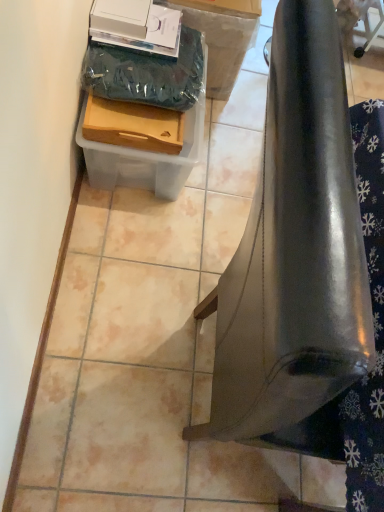
Locate an element on the screen. The height and width of the screenshot is (512, 384). free space to the right of clear plastic container at lower left, placed as the 2th box when sorted from front to back is located at coordinates (211, 207).